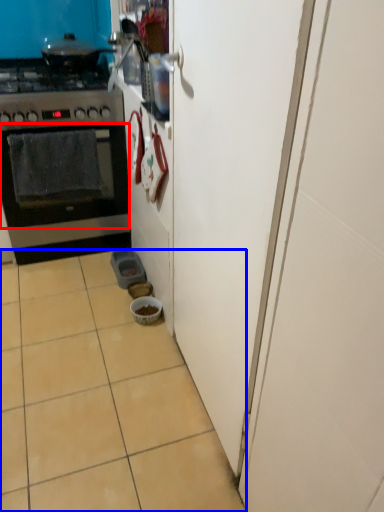
Question: Which of the following is the farthest to the observer, oven (highlighted by a red box) or ceramic tile (highlighted by a blue box)?

Choices:
 (A) oven
 (B) ceramic tile

Answer: (A)